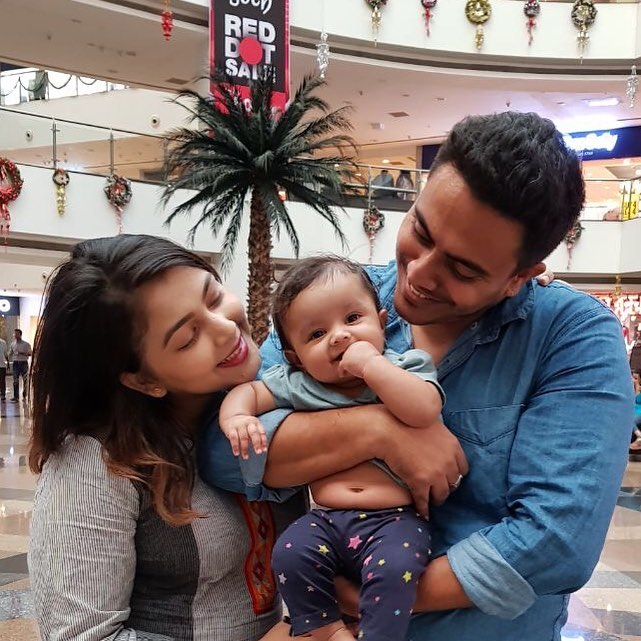
The height and width of the screenshot is (641, 641). I want to click on white neon light, so click(x=609, y=147).